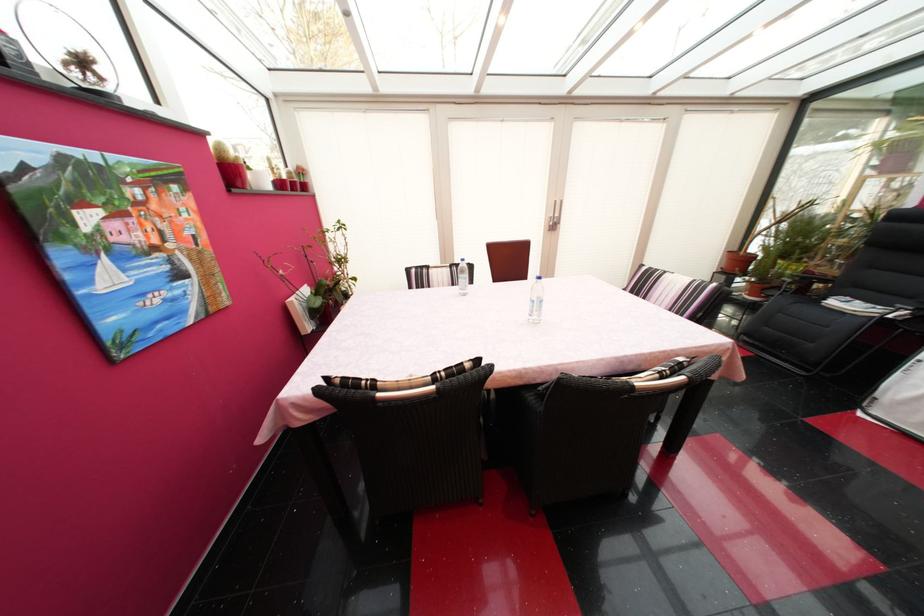
Which object does [536,301] point to?

It refers to a plastic water bottle.